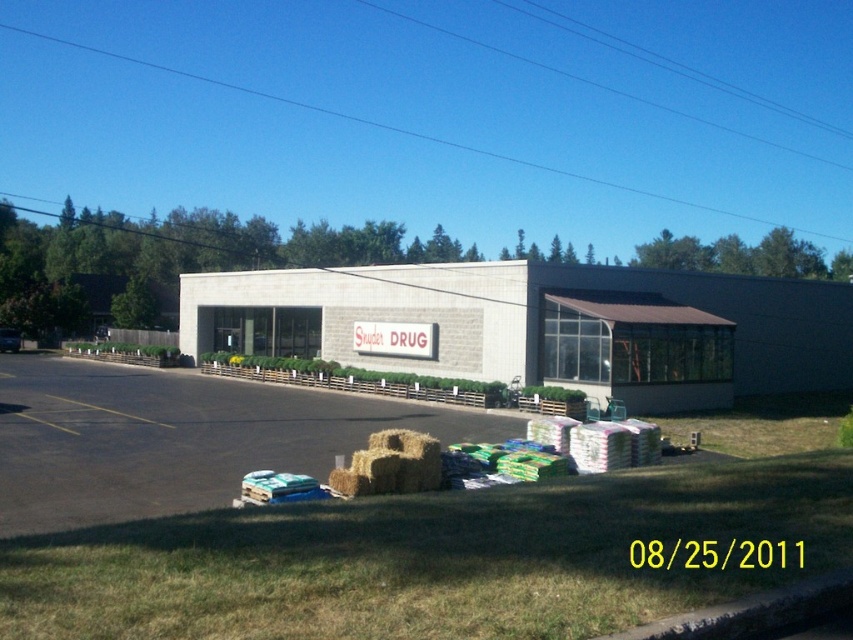
Question: Is dark asphalt parking lot at lower left to the left of balehayat lower center from the viewer's perspective?

Choices:
 (A) no
 (B) yes

Answer: (B)

Question: Which point is farther to the camera?

Choices:
 (A) balehayat lower center
 (B) dark asphalt parking lot at lower left

Answer: (A)

Question: Can you confirm if dark asphalt parking lot at lower left is positioned to the left of balehayat lower center?

Choices:
 (A) no
 (B) yes

Answer: (B)

Question: Is dark asphalt parking lot at lower left wider than balehayat lower center?

Choices:
 (A) no
 (B) yes

Answer: (B)

Question: Among these objects, which one is farthest from the camera?

Choices:
 (A) dark asphalt parking lot at lower left
 (B) balehayat lower center

Answer: (B)